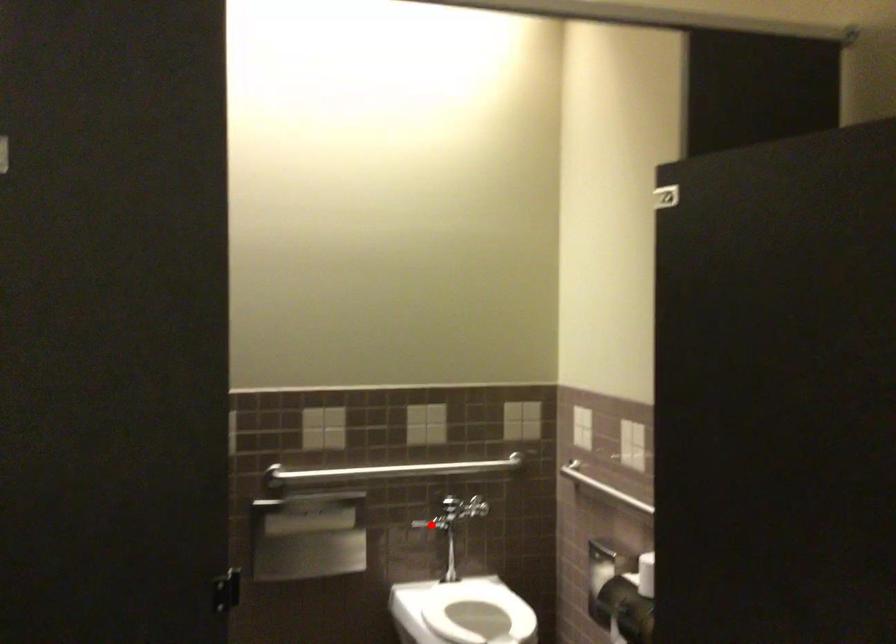
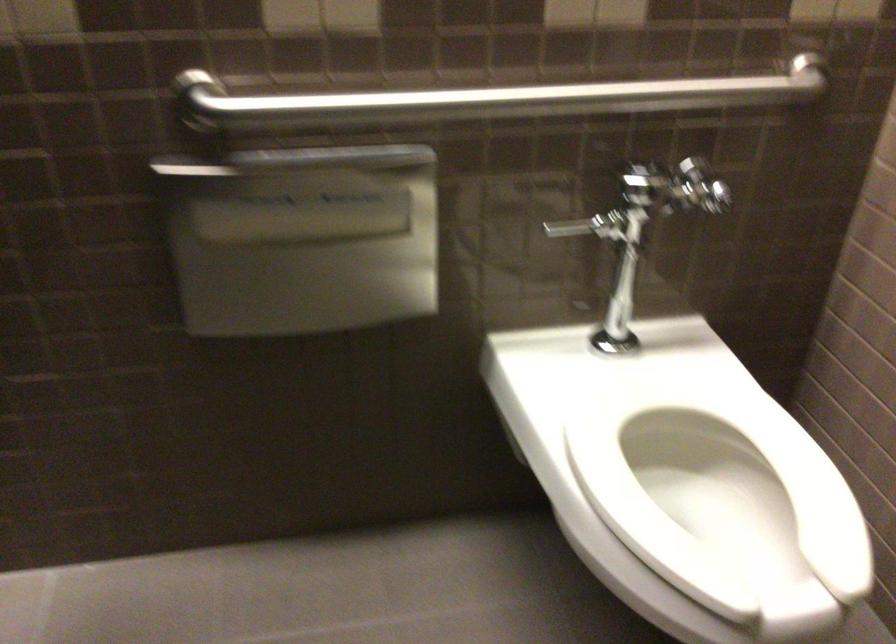
Question: I am providing you with two images of the same scene from different viewpoints. A red point is shown in image1. For the corresponding object point in image2, is it positioned nearer or farther from the camera?

Choices:
 (A) Nearer
 (B) Farther

Answer: (A)